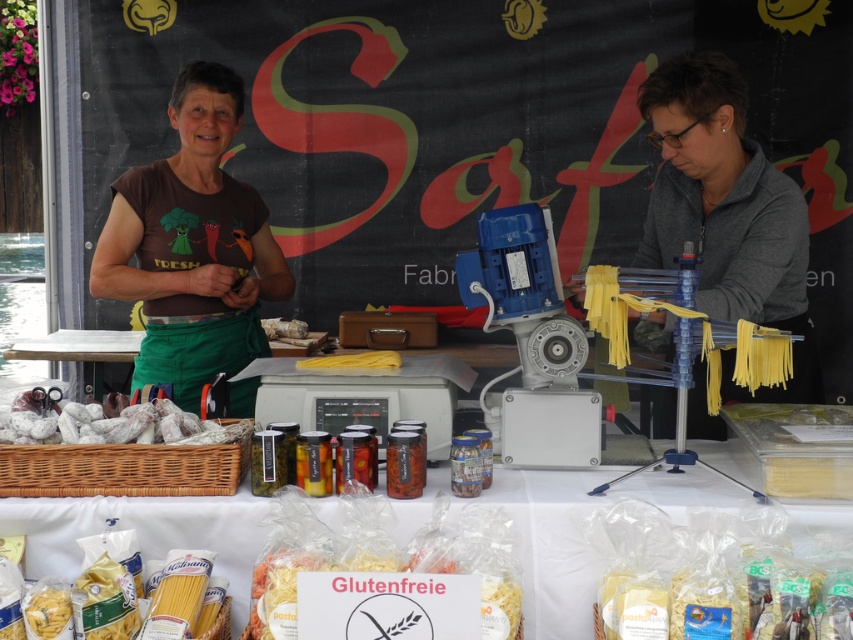
What is located at the coordinates point (398, 604)?

The point (398, 604) has gluten free pasta at center.

You are a customer at the market stall and want to know which item is taller between the brown fabric shirt at center and the translucent plastic pasta at lower center. Which one is taller?

The brown fabric shirt at center is taller than the translucent plastic pasta at lower center according to the description.